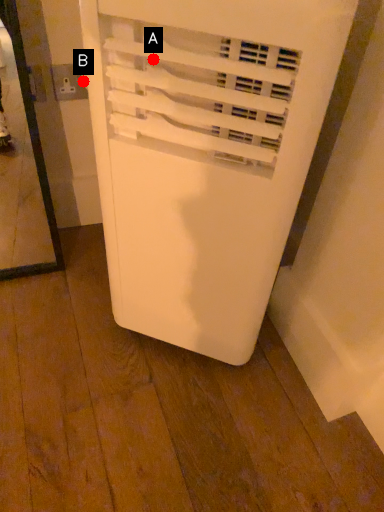
Question: Two points are circled on the image, labeled by A and B beside each circle. Which point is closer to the camera?

Choices:
 (A) A is closer
 (B) B is closer

Answer: (A)